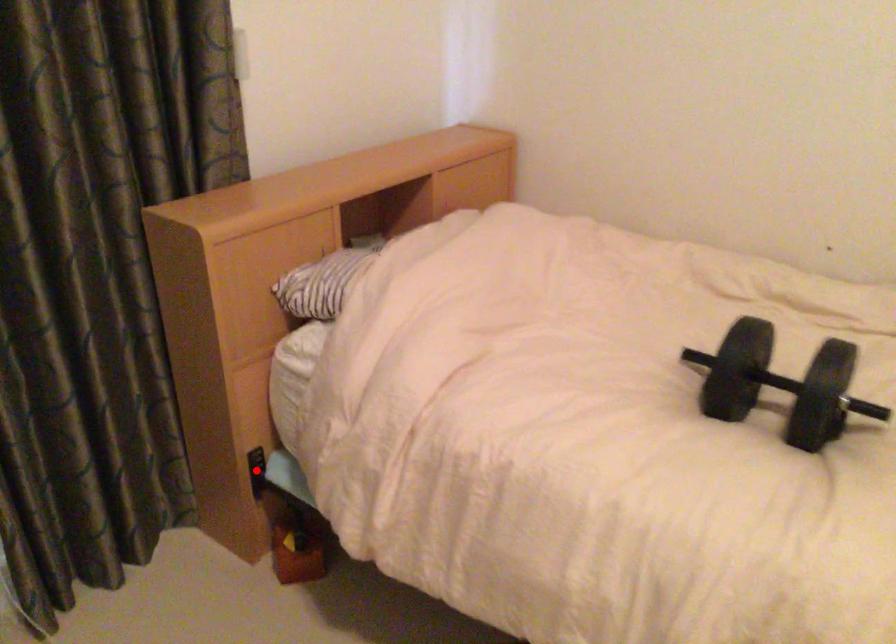
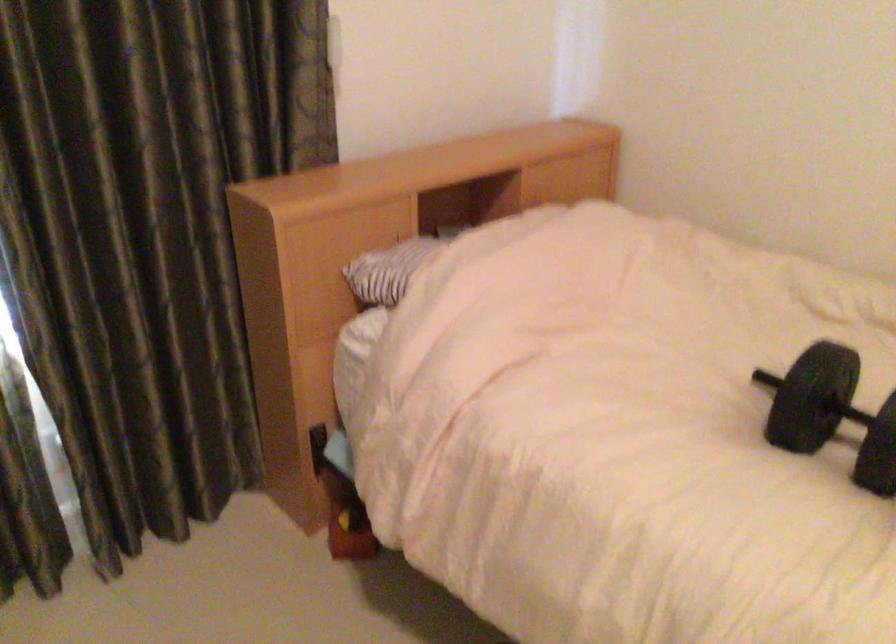
The point at the highlighted location is marked in the first image. Where is the corresponding point in the second image?

(317, 447)